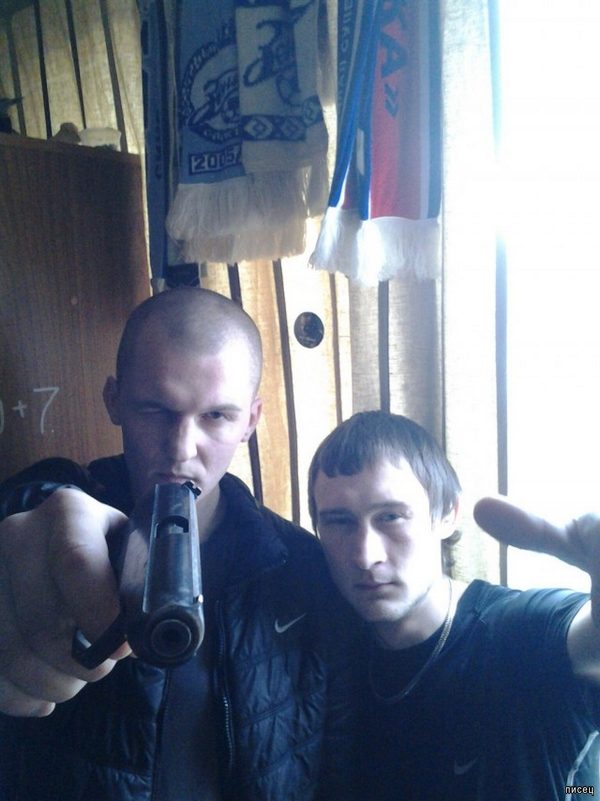
At what (x,y) coordinates should I click in order to perform the action: click on curtains. Please return your answer as a coordinate pair (x, y). The width and height of the screenshot is (600, 801). Looking at the image, I should click on (27, 51), (70, 54), (114, 35), (241, 279), (346, 296), (416, 310).